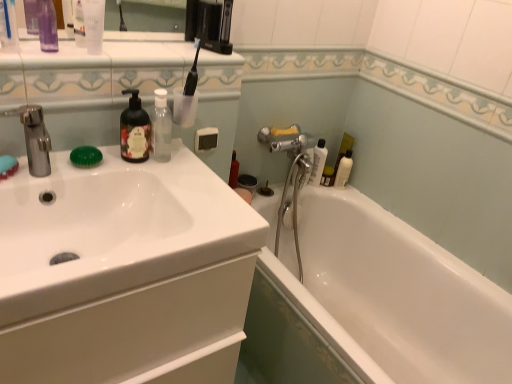
The height and width of the screenshot is (384, 512). In order to click on vacant point to the right of green translucent soap at left in this screenshot , I will do `click(143, 167)`.